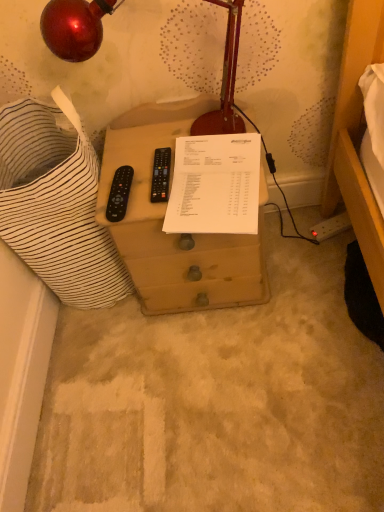
Locate an element on the screen. empty space that is ontop of brown wooden drawer at center (from a real-world perspective) is located at coordinates (171, 170).